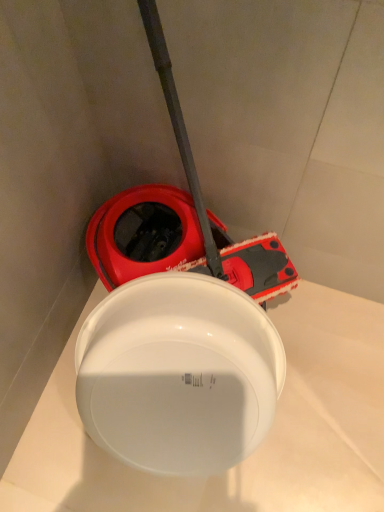
What do you see at coordinates (260, 445) in the screenshot?
I see `white glossy table at center` at bounding box center [260, 445].

You are a GUI agent. You are given a task and a screenshot of the screen. Output one action in this format:
    pyautogui.click(x=<x>, y=<y>)
    Task: Click on the white glossy table at center
    This screenshot has height=512, width=384.
    Given the screenshot: What is the action you would take?
    pyautogui.click(x=260, y=445)

Locate an element on the screen. white glossy table at center is located at coordinates (260, 445).